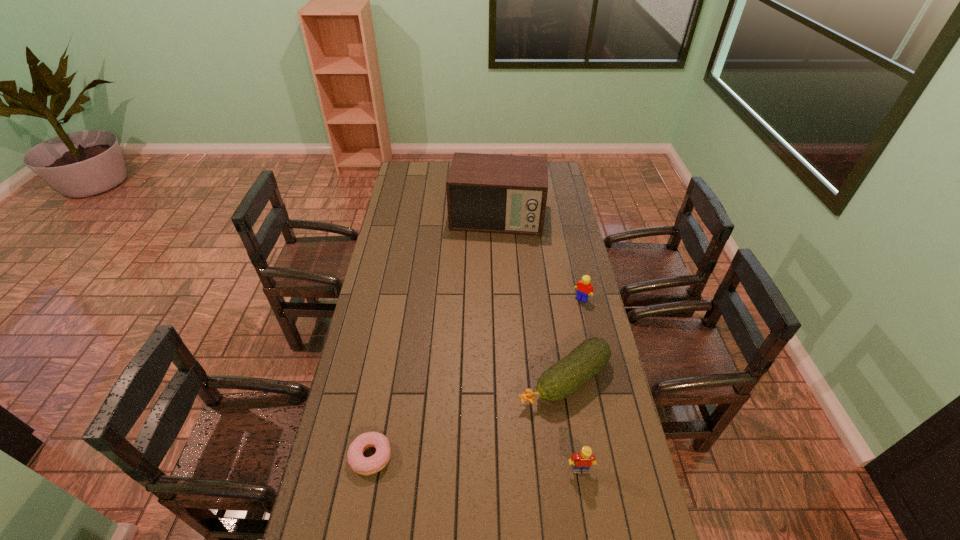
Identify the location of the leftmost object. The image size is (960, 540). (359, 464).

Identify the location of doughnut. This screenshot has height=540, width=960. tap(359, 464).

Where is `the nearer Lego`? The width and height of the screenshot is (960, 540). the nearer Lego is located at coordinates (581, 462).

The width and height of the screenshot is (960, 540). What are the coordinates of `the farthest object` in the screenshot? It's located at (493, 193).

Locate an element on the screen. Image resolution: width=960 pixels, height=540 pixels. radio receiver is located at coordinates (493, 193).

Find the location of a particular element. the fourth nearest object is located at coordinates (584, 286).

What are the coordinates of `the farther Lego` in the screenshot? It's located at (584, 286).

I want to click on cucumber, so click(x=563, y=378).

Identify the location of the fourth tallest object. (563, 378).

Image resolution: width=960 pixels, height=540 pixels. What are the coordinates of `free space located 0.220m on the right of the shortest object` in the screenshot? It's located at (x=465, y=456).